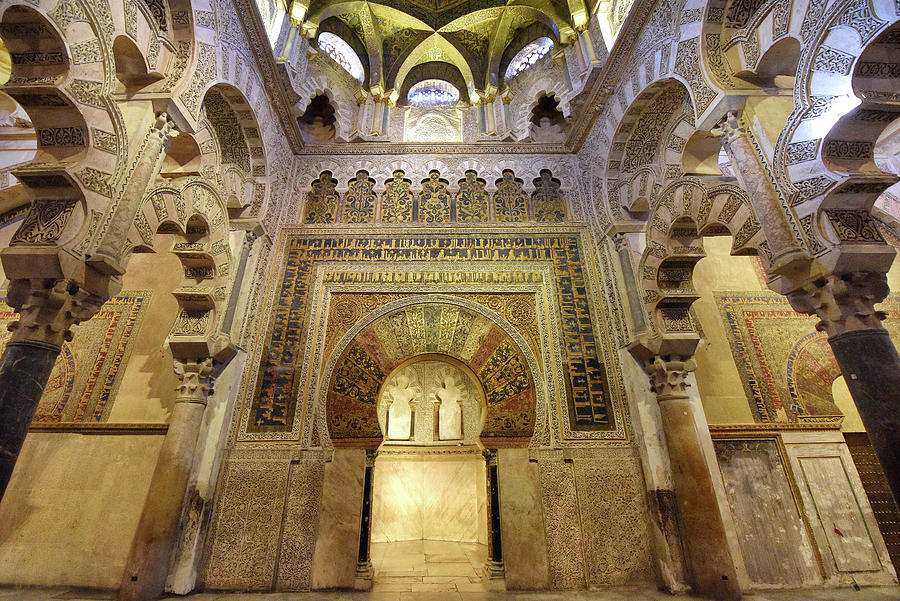
Where is `wall mural`? The height and width of the screenshot is (601, 900). wall mural is located at coordinates (75, 371), (776, 346), (426, 337), (339, 246), (344, 313), (513, 308).